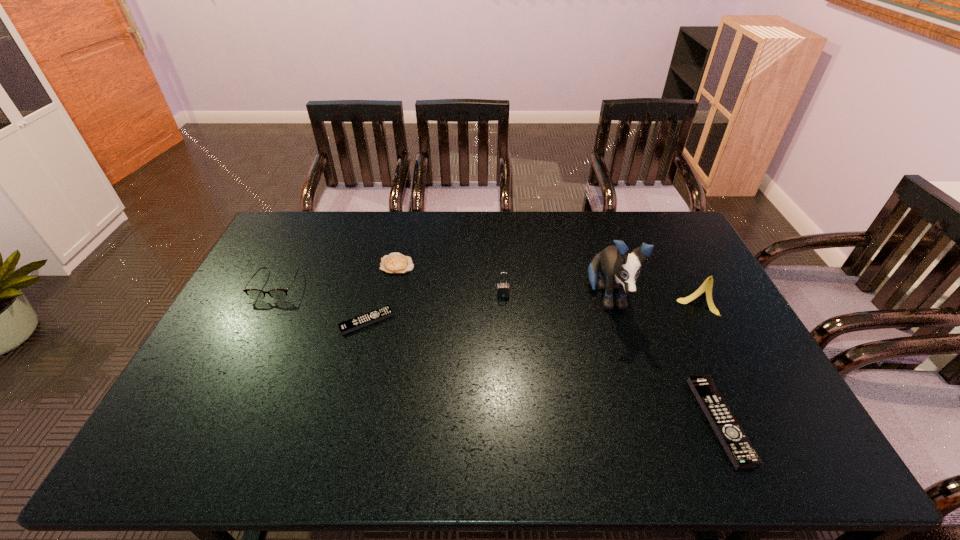
You are a GUI agent. You are given a task and a screenshot of the screen. Output one action in this format:
    pyautogui.click(x=<x>, y=<y>)
    Task: Click on the shorter remote control
    
    Given the screenshot: What is the action you would take?
    pyautogui.click(x=366, y=319)

Locate an element on the screen. the left remote control is located at coordinates (366, 319).

At what (x,y) coordinates should I click in order to perform the action: click on the taller remote control. Please return your answer as a coordinate pair (x, y). This screenshot has height=540, width=960. Looking at the image, I should click on (739, 449).

The width and height of the screenshot is (960, 540). Identify the location of the right remote control. (739, 449).

The height and width of the screenshot is (540, 960). In order to click on the tallest object in this screenshot , I will do `click(619, 270)`.

Locate an element on the screen. Image resolution: width=960 pixels, height=540 pixels. puppy is located at coordinates (619, 270).

I want to click on the third tallest object, so click(503, 290).

In order to click on the fourth object from left to right in this screenshot , I will do `click(503, 290)`.

The width and height of the screenshot is (960, 540). In order to click on quiche in this screenshot , I will do `click(395, 263)`.

Locate an element on the screen. the leftmost object is located at coordinates (255, 294).